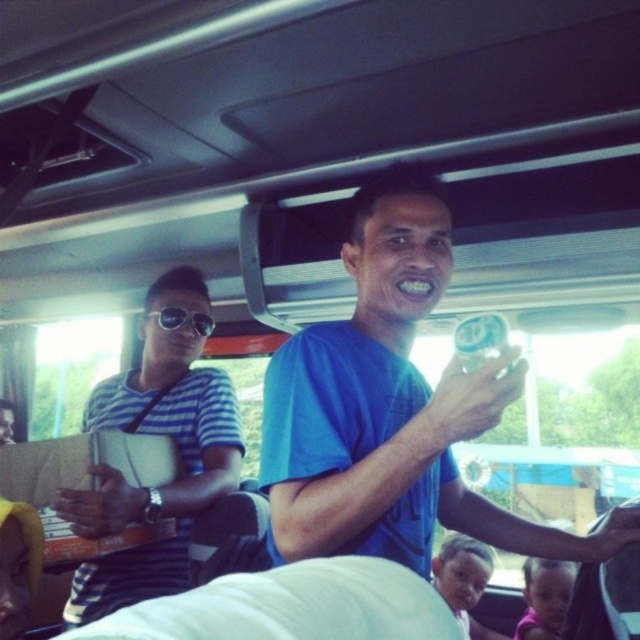
Is blue matte shirt at center bigger than striped fabric shirt at left?

Incorrect, blue matte shirt at center is not larger than striped fabric shirt at left.

Does point (372, 532) come behind point (173, 396)?

No, it is in front of (173, 396).

The image size is (640, 640). I want to click on blue matte shirt at center, so point(392,408).

Can you confirm if blue matte shirt at center is shorter than black reflective sunglasses at upper center?

No, blue matte shirt at center is not shorter than black reflective sunglasses at upper center.

Can you confirm if blue matte shirt at center is positioned below black reflective sunglasses at upper center?

Correct, blue matte shirt at center is located below black reflective sunglasses at upper center.

You are a GUI agent. You are given a task and a screenshot of the screen. Output one action in this format:
    pyautogui.click(x=<x>, y=<y>)
    Task: Click on the blue matte shirt at center
    This screenshot has height=640, width=640.
    Given the screenshot: What is the action you would take?
    pyautogui.click(x=392, y=408)

The width and height of the screenshot is (640, 640). I want to click on blue matte shirt at center, so click(x=392, y=408).

Who is taller, striped fabric shirt at left or black reflective sunglasses at upper center?

striped fabric shirt at left

Can you confirm if striped fabric shirt at left is positioned to the left of black reflective sunglasses at upper center?

Yes, striped fabric shirt at left is to the left of black reflective sunglasses at upper center.

Who is more forward, (180, 294) or (188, 317)?

Point (188, 317) is more forward.

The image size is (640, 640). In order to click on striped fabric shirt at left in this screenshot , I will do `click(157, 488)`.